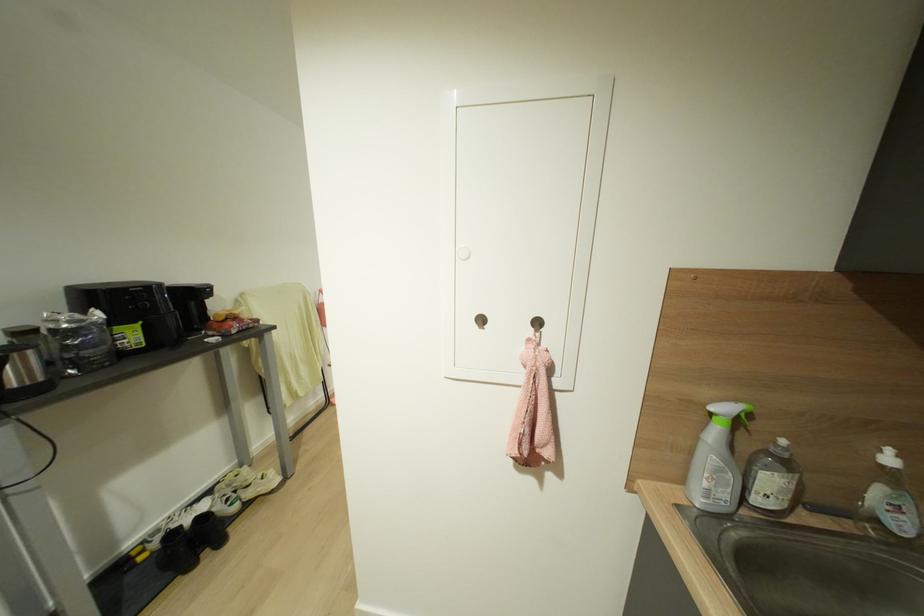
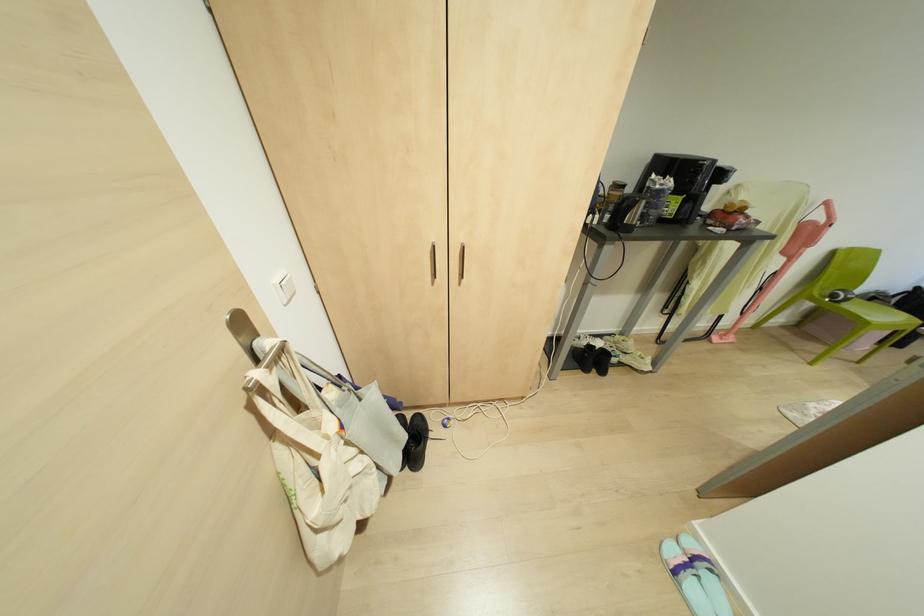
Where in the second image is the point corresponding to pixel 73 371 from the first image?

(637, 223)